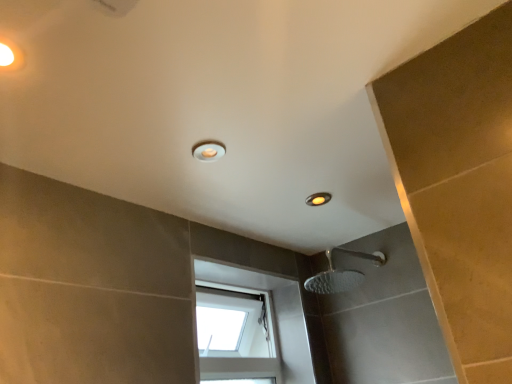
This screenshot has height=384, width=512. Describe the element at coordinates (208, 150) in the screenshot. I see `matte white light fixture at upper center` at that location.

The width and height of the screenshot is (512, 384). Identify the location of matte white light fixture at upper center. (208, 150).

What is the approximate height of transparent glass window at center?

It is 15.14 inches.

In the scene shown: In order to face transparent glass window at center, should I rotate leftwards or rightwards?

It's best to rotate left around 3.039 degrees.

At what (x,y) coordinates should I click in order to perform the action: click on transparent glass window at center. Please return your answer as a coordinate pair (x, y). The width and height of the screenshot is (512, 384). Looking at the image, I should click on (249, 327).

Describe the element at coordinates (249, 327) in the screenshot. I see `transparent glass window at center` at that location.

The width and height of the screenshot is (512, 384). What are the coordinates of `matte white light fixture at upper center` in the screenshot? It's located at (208, 150).

Between matte white light fixture at upper center and transparent glass window at center, which one appears on the left side from the viewer's perspective?

Positioned to the left is matte white light fixture at upper center.

Considering their positions, is matte white light fixture at upper center located in front of or behind transparent glass window at center?

In the image, matte white light fixture at upper center appears in front of transparent glass window at center.

Does point (216, 154) appear closer or farther from the camera than point (300, 348)?

Point (216, 154) appears to be closer to the viewer than point (300, 348).

From the image's perspective, between matte white light fixture at upper center and transparent glass window at center, who is located below?

From the image's view, transparent glass window at center is below.

From a real-world perspective, between matte white light fixture at upper center and transparent glass window at center, who is vertically lower?

In real-world perspective, transparent glass window at center is lower.

Considering the relative sizes of matte white light fixture at upper center and transparent glass window at center in the image provided, is matte white light fixture at upper center wider than transparent glass window at center?

In fact, matte white light fixture at upper center might be narrower than transparent glass window at center.

Considering the relative sizes of matte white light fixture at upper center and transparent glass window at center in the image provided, is matte white light fixture at upper center taller than transparent glass window at center?

Incorrect, the height of matte white light fixture at upper center is not larger of that of transparent glass window at center.

Is matte white light fixture at upper center smaller than transparent glass window at center?

Indeed, matte white light fixture at upper center has a smaller size compared to transparent glass window at center.

Is matte white light fixture at upper center positioned beyond the bounds of transparent glass window at center?

Absolutely, matte white light fixture at upper center is external to transparent glass window at center.

Is matte white light fixture at upper center not close to transparent glass window at center?

No, matte white light fixture at upper center is not far away from transparent glass window at center.

From the picture: Does matte white light fixture at upper center turn towards transparent glass window at center?

No, matte white light fixture at upper center is not oriented towards transparent glass window at center.

Identify the location of light fixture that is above the transparent glass window at center (from the image's perspective). This screenshot has height=384, width=512. (208, 150).

Considering the relative positions of transparent glass window at center and matte white light fixture at upper center in the image provided, is transparent glass window at center to the right of matte white light fixture at upper center from the viewer's perspective?

Yes.

Considering the positions of objects transparent glass window at center and matte white light fixture at upper center in the image provided, who is behind, transparent glass window at center or matte white light fixture at upper center?

transparent glass window at center is further away from the camera.

Is point (206, 342) closer to camera compared to point (207, 153)?

No, it is behind (207, 153).

From the image's perspective, between transparent glass window at center and matte white light fixture at upper center, who is located below?

From the image's view, transparent glass window at center is below.

From a real-world perspective, which object rests below the other?

transparent glass window at center is physically lower.

Can you confirm if transparent glass window at center is thinner than matte white light fixture at upper center?

Incorrect, the width of transparent glass window at center is not less than that of matte white light fixture at upper center.

Can you confirm if transparent glass window at center is taller than matte white light fixture at upper center?

Yes.

Who is smaller, transparent glass window at center or matte white light fixture at upper center?

matte white light fixture at upper center is smaller.

Is transparent glass window at center positioned beyond the bounds of matte white light fixture at upper center?

Yes, transparent glass window at center is located beyond the bounds of matte white light fixture at upper center.

Are transparent glass window at center and matte white light fixture at upper center beside each other?

transparent glass window at center and matte white light fixture at upper center are clearly separated.

Is matte white light fixture at upper center at the back of transparent glass window at center?

No, matte white light fixture at upper center is not at the back of transparent glass window at center.

How far apart are transparent glass window at center and matte white light fixture at upper center?

Answer: The distance of transparent glass window at center from matte white light fixture at upper center is 87.48 centimeters.

This screenshot has width=512, height=384. Identify the location of window on the right of matte white light fixture at upper center. (249, 327).

Locate an element on the screen. window behind the matte white light fixture at upper center is located at coordinates (249, 327).

At what (x,y) coordinates should I click in order to perform the action: click on light fixture located above the transparent glass window at center (from the image's perspective). Please return your answer as a coordinate pair (x, y). The image size is (512, 384). Looking at the image, I should click on (208, 150).